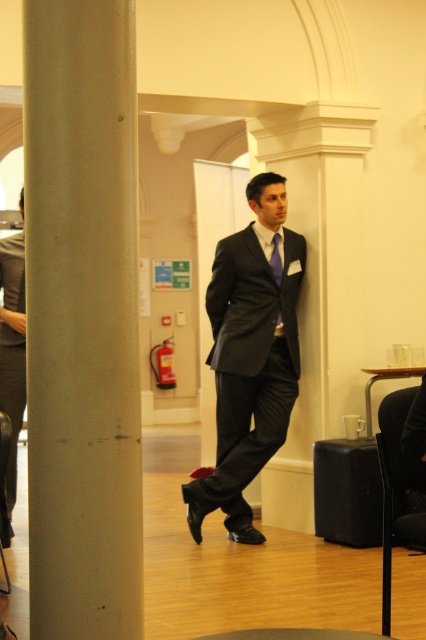
Does matte black suit at center have a smaller size compared to silky blue tie at center?

No.

Consider the image. Does matte black suit at center have a greater width compared to silky blue tie at center?

Indeed, matte black suit at center has a greater width compared to silky blue tie at center.

From the picture: Measure the distance between point (16, 467) and camera.

Point (16, 467) and camera are 5.38 meters apart.

In order to click on matte black suit at center in this screenshot , I will do `click(13, 353)`.

Does dark gray suit at center have a greater height compared to silky blue tie at center?

Yes, dark gray suit at center is taller than silky blue tie at center.

Is dark gray suit at center positioned in front of silky blue tie at center?

That is True.

Where is `dark gray suit at center`? The height and width of the screenshot is (640, 426). dark gray suit at center is located at coordinates (250, 356).

Where is `dark gray suit at center`? dark gray suit at center is located at coordinates (250, 356).

From the picture: Between dark gray suit at center and black leather chair at center, which one is positioned higher?

Positioned higher is dark gray suit at center.

Describe the element at coordinates (250, 356) in the screenshot. I see `dark gray suit at center` at that location.

Does point (195, 492) come behind point (0, 484)?

Yes.

I want to click on dark gray suit at center, so click(250, 356).